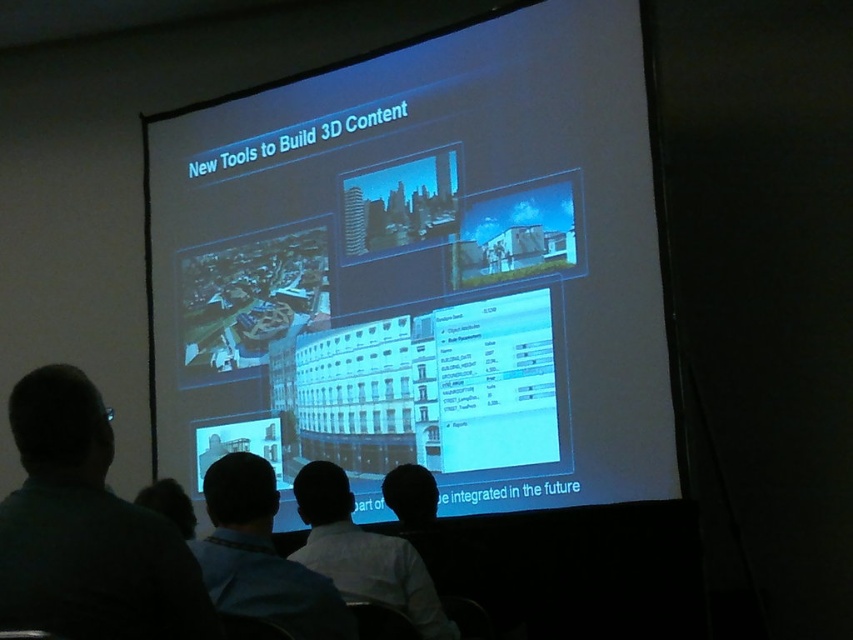
Is blue shirt at center positioned behind white shirt at lower center?

No, it is in front of white shirt at lower center.

Between blue shirt at center and white shirt at lower center, which one appears on the left side from the viewer's perspective?

blue shirt at center is more to the left.

I want to click on blue shirt at center, so click(260, 556).

Between dark green shirt at lower left and white shirt at lower center, which one is positioned higher?

Positioned higher is dark green shirt at lower left.

The height and width of the screenshot is (640, 853). What do you see at coordinates (86, 529) in the screenshot? I see `dark green shirt at lower left` at bounding box center [86, 529].

You are a GUI agent. You are given a task and a screenshot of the screen. Output one action in this format:
    pyautogui.click(x=<x>, y=<y>)
    Task: Click on the dark green shirt at lower left
    The image size is (853, 640).
    Given the screenshot: What is the action you would take?
    pyautogui.click(x=86, y=529)

Can you confirm if white matte screen at center is wider than dark green shirt at lower left?

Indeed, white matte screen at center has a greater width compared to dark green shirt at lower left.

Which of these two, white matte screen at center or dark green shirt at lower left, stands taller?

Standing taller between the two is white matte screen at center.

Is point (465, 412) positioned after point (96, 577)?

Yes.

Where is `white matte screen at center`? The width and height of the screenshot is (853, 640). white matte screen at center is located at coordinates (422, 269).